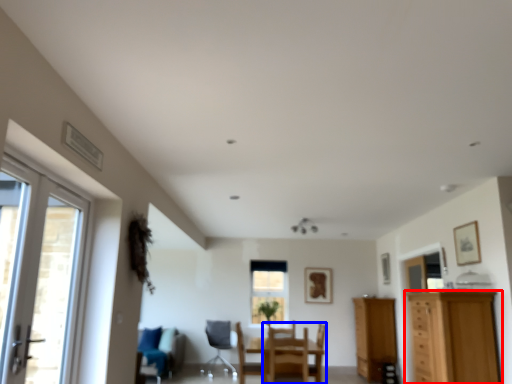
Question: Which object appears farthest to the camera in this image, cabinetry (highlighted by a red box) or chair (highlighted by a blue box)?

Choices:
 (A) cabinetry
 (B) chair

Answer: (B)